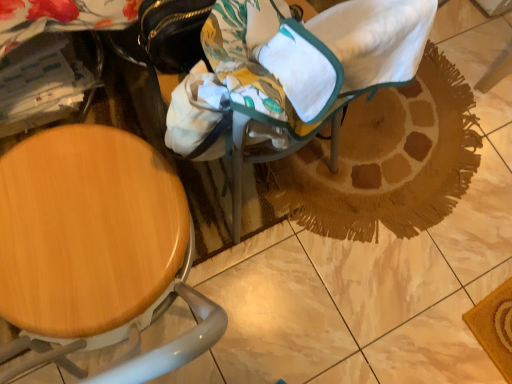
Measure the distance between brown woven mat at center and camera.

brown woven mat at center is 4.03 feet away from camera.

What are the coordinates of `brown woven mat at center` in the screenshot? It's located at (387, 160).

This screenshot has width=512, height=384. Describe the element at coordinates (95, 251) in the screenshot. I see `wooden seat at left` at that location.

The height and width of the screenshot is (384, 512). I want to click on brown woven mat at center, so [x=387, y=160].

From the image's perspective, which is below, brown woven mat at center or canvas fabric baby carriage at center?

brown woven mat at center.

Is point (448, 187) positioned before point (349, 88)?

No, it is behind (349, 88).

Is brown woven mat at center far away from canvas fabric baby carriage at center?

No, brown woven mat at center is not far from canvas fabric baby carriage at center.

Is canvas fabric baby carriage at center thinner than brown woven mat at center?

Yes.

In the scene shown: Can you confirm if canvas fabric baby carriage at center is taller than brown woven mat at center?

Yes, canvas fabric baby carriage at center is taller than brown woven mat at center.

Locate an element on the screen. baby carriage on the left of brown woven mat at center is located at coordinates (306, 65).

Considering the sizes of objects wooden seat at left and brown woven mat at center in the image provided, who is smaller, wooden seat at left or brown woven mat at center?

brown woven mat at center.

Where is `chair on the left of brown woven mat at center`? chair on the left of brown woven mat at center is located at coordinates (95, 251).

From a real-world perspective, which object stands above the other?

wooden seat at left is physically above.

Would you say canvas fabric baby carriage at center contains wooden seat at left?

No, wooden seat at left is not surrounded by canvas fabric baby carriage at center.

Who is shorter, canvas fabric baby carriage at center or wooden seat at left?

With less height is canvas fabric baby carriage at center.

From the image's perspective, is brown woven mat at center under wooden seat at left?

Incorrect, from the image's perspective, brown woven mat at center is higher than wooden seat at left.

In the image, is brown woven mat at center on the left side or the right side of wooden seat at left?

Based on their positions, brown woven mat at center is located to the right of wooden seat at left.

Is brown woven mat at center located outside wooden seat at left?

Yes, brown woven mat at center is not within wooden seat at left.

What's the angular difference between wooden seat at left and canvas fabric baby carriage at center's facing directions?

There is a 15.3-degree angle between the facing directions of wooden seat at left and canvas fabric baby carriage at center.

Which object is further away from the camera, wooden seat at left or canvas fabric baby carriage at center?

canvas fabric baby carriage at center.

From a real-world perspective, who is located lower, wooden seat at left or canvas fabric baby carriage at center?

wooden seat at left is physically lower.

Could canvas fabric baby carriage at center be considered to be inside wooden seat at left?

That's incorrect, canvas fabric baby carriage at center is not inside wooden seat at left.

Where is `doormat behind the canvas fabric baby carriage at center`? This screenshot has width=512, height=384. doormat behind the canvas fabric baby carriage at center is located at coordinates (387, 160).

The height and width of the screenshot is (384, 512). In order to click on doormat below the canvas fabric baby carriage at center (from a real-world perspective) in this screenshot , I will do `click(387, 160)`.

When comparing their distances from canvas fabric baby carriage at center, does brown woven mat at center or wooden seat at left seem closer?

wooden seat at left.

Which object lies further to the anchor point wooden seat at left, canvas fabric baby carriage at center or brown woven mat at center?

Based on the image, brown woven mat at center appears to be further to wooden seat at left.

Estimate the real-world distances between objects in this image. Which object is further from wooden seat at left, brown woven mat at center or canvas fabric baby carriage at center?

brown woven mat at center is further to wooden seat at left.

Looking at the image, which one is located closer to brown woven mat at center, wooden seat at left or canvas fabric baby carriage at center?

canvas fabric baby carriage at center.

Which object lies further to the anchor point brown woven mat at center, canvas fabric baby carriage at center or wooden seat at left?

wooden seat at left.

Estimate the real-world distances between objects in this image. Which object is closer to canvas fabric baby carriage at center, wooden seat at left or brown woven mat at center?

Among the two, wooden seat at left is located nearer to canvas fabric baby carriage at center.

Locate an element on the screen. baby carriage between wooden seat at left and brown woven mat at center in the front-back direction is located at coordinates (306, 65).